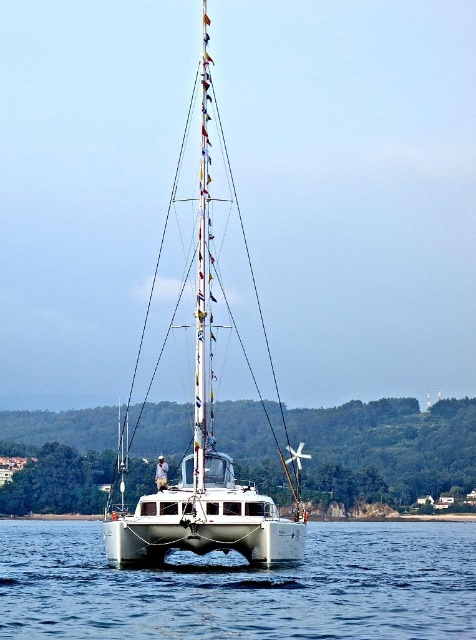
You are standing on the deck of the catamaran and notice a point marked at coordinates (337, 525). Considering the catamaran is 100 feet long, can you estimate how far this point is from the front of the catamaran?

The point at coordinates (337, 525) is 800.08 feet from the viewer. However, since the catamaran itself is only 100 feet long, this distance likely refers to the distance from the viewer to the point in the scene, not along the boat. Therefore, it is not possible to accurately estimate the distance from the front of the catamaran using this information alone.

You are a photographer on a nearby boat and want to capture the white glossy sailboat at center and the clear blue water at center in your shot. Which object will appear larger in your photo?

The clear blue water at center is closer to the viewer than the white glossy sailboat at center, so it will appear larger in the photo.